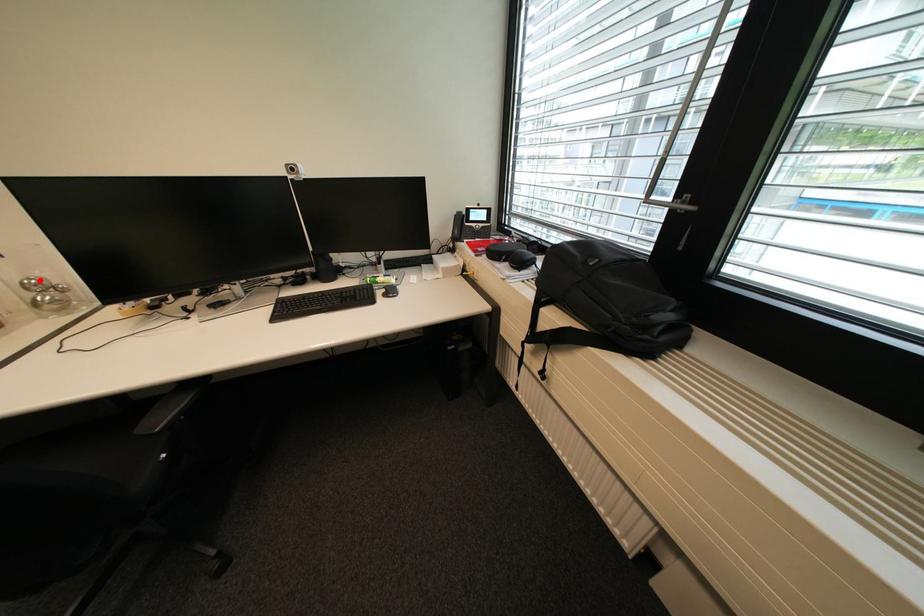
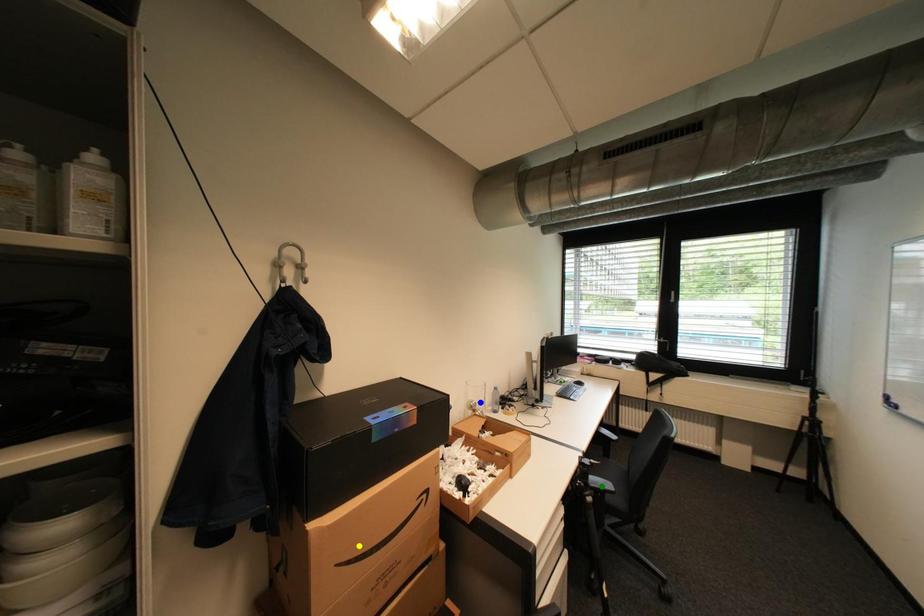
Question: I am providing you with two images of the same scene from different viewpoints. A red point is marked on the first image. You are given multiple points on the second image. In image 2, which mark is for the same physical point as the one in image 1?

Choices:
 (A) green point
 (B) yellow point
 (C) blue point

Answer: (C)